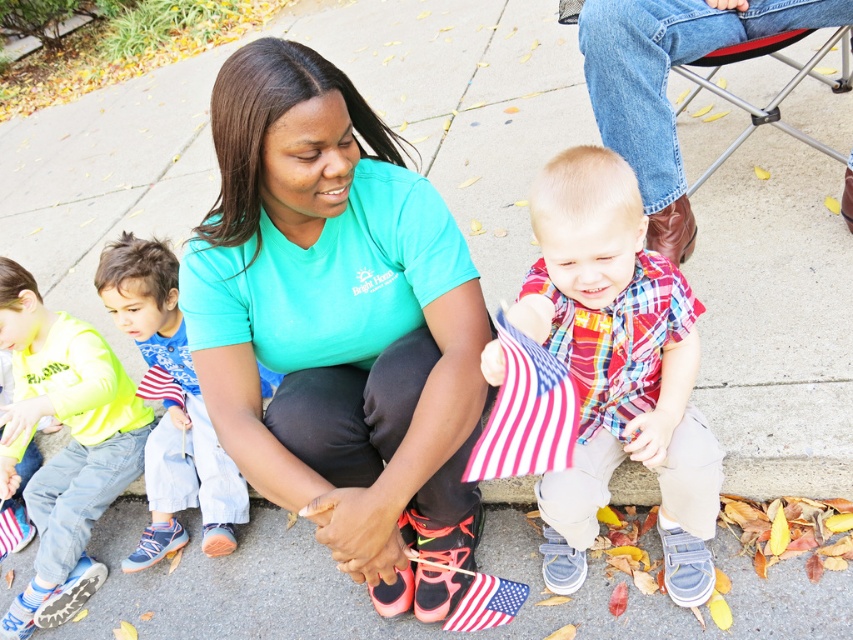
Question: Is teal matte shirt at center positioned in front of neon yellow shirt at left?

Choices:
 (A) no
 (B) yes

Answer: (B)

Question: Can you confirm if teal matte shirt at center is thinner than neon yellow shirt at left?

Choices:
 (A) yes
 (B) no

Answer: (B)

Question: Which point is closer to the camera?

Choices:
 (A) (177, 436)
 (B) (706, 524)
 (C) (57, 328)
 (D) (271, 118)

Answer: (D)

Question: Which point is farther to the camera?

Choices:
 (A) blue denim pants at left
 (B) plaid cotton shirt at center
 (C) teal matte shirt at center
 (D) neon yellow shirt at left

Answer: (D)

Question: Which point appears closest to the camera in this image?

Choices:
 (A) (621, 317)
 (B) (155, 556)
 (C) (250, 344)
 (D) (32, 598)

Answer: (A)

Question: Can you confirm if teal matte shirt at center is smaller than blue denim pants at left?

Choices:
 (A) no
 (B) yes

Answer: (A)